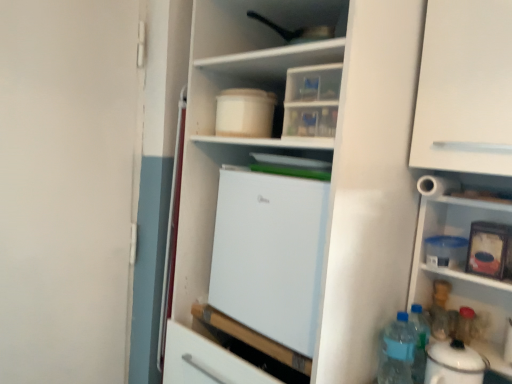
Question: Is the position of white matte refrigerator at center less distant than that of blue plastic bottle at lower right, the first bottle viewed from the back?

Choices:
 (A) no
 (B) yes

Answer: (B)

Question: Is white matte refrigerator at center facing away from blue plastic bottle at lower right, positioned as the third bottle in front-to-back order?

Choices:
 (A) no
 (B) yes

Answer: (A)

Question: Can you confirm if white matte refrigerator at center is wider than blue plastic bottle at lower right, positioned as the third bottle in front-to-back order?

Choices:
 (A) no
 (B) yes

Answer: (B)

Question: From a real-world perspective, is white matte refrigerator at center under blue plastic bottle at lower right, the first bottle viewed from the back?

Choices:
 (A) no
 (B) yes

Answer: (A)

Question: From a real-world perspective, is white matte refrigerator at center on top of blue plastic bottle at lower right, the first bottle viewed from the back?

Choices:
 (A) yes
 (B) no

Answer: (A)

Question: Is white matte refrigerator at center directly adjacent to blue plastic bottle at lower right, positioned as the third bottle in front-to-back order?

Choices:
 (A) no
 (B) yes

Answer: (A)

Question: Is white matte refrigerator at center taller than translucent plastic bottles at lower right, the first bottle viewed from the left?

Choices:
 (A) no
 (B) yes

Answer: (B)

Question: Is white matte refrigerator at center directly adjacent to translucent plastic bottles at lower right, the first bottle viewed from the left?

Choices:
 (A) no
 (B) yes

Answer: (A)

Question: Is white matte refrigerator at center to the left of translucent plastic bottles at lower right, positioned as the 3th bottle in back-to-front order, from the viewer's perspective?

Choices:
 (A) yes
 (B) no

Answer: (A)

Question: Is white matte refrigerator at center behind translucent plastic bottles at lower right, which ranks as the 3th bottle in right-to-left order?

Choices:
 (A) yes
 (B) no

Answer: (B)

Question: Can you confirm if white matte refrigerator at center is shorter than translucent plastic bottles at lower right, which ranks as the 3th bottle in right-to-left order?

Choices:
 (A) no
 (B) yes

Answer: (A)

Question: Is white matte refrigerator at center not close to translucent plastic bottles at lower right, the first bottle viewed from the left?

Choices:
 (A) no
 (B) yes

Answer: (A)

Question: From a real-world perspective, is white glossy electric kettle at lower right over white matte cabinet at upper right?

Choices:
 (A) yes
 (B) no

Answer: (B)